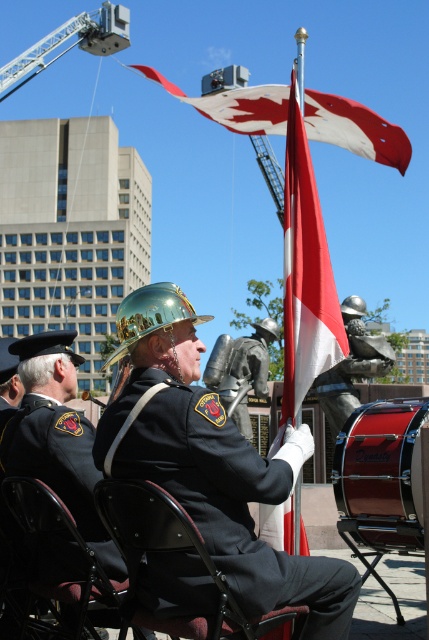
Question: Which of the following is the farthest from the observer?

Choices:
 (A) black fabric uniform at center
 (B) metallic silver chair at center
 (C) metallic black chair at center

Answer: (B)

Question: Is black fabric uniform at center further to camera compared to black leather jacket at left?

Choices:
 (A) no
 (B) yes

Answer: (A)

Question: Estimate the real-world distances between objects in this image. Which object is closer to the metallic black chair at center?

Choices:
 (A) metallic silver chair at center
 (B) red/white fabric flag at upper center
 (C) black fabric uniform at center
 (D) metallic helmet at center

Answer: (C)

Question: Which of these objects is positioned closest to the metallic helmet at center?

Choices:
 (A) black fabric uniform at center
 (B) metallic silver chair at center
 (C) black leather jacket at left

Answer: (C)

Question: Is red/white fabric flag at upper center thinner than metallic helmet at center?

Choices:
 (A) yes
 (B) no

Answer: (B)

Question: Can you confirm if black fabric uniform at center is positioned above metallic helmet at center?

Choices:
 (A) no
 (B) yes

Answer: (B)